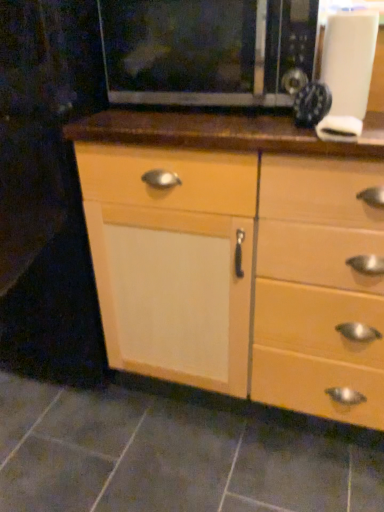
Locate an element on the screen. vacant area situated to the left side of metallic black clock at upper right is located at coordinates (228, 120).